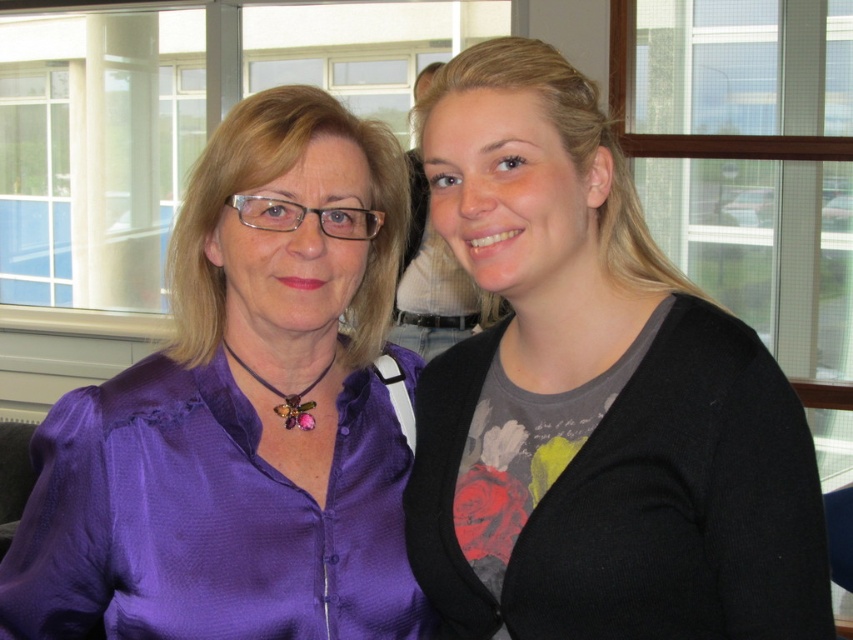
Question: Which of the following is the farthest from the observer?

Choices:
 (A) black matte sweater at right
 (B) purple satin blouse at center

Answer: (B)

Question: Is black matte sweater at right closer to camera compared to purple satin blouse at center?

Choices:
 (A) no
 (B) yes

Answer: (B)

Question: Can you confirm if black matte sweater at right is positioned to the left of purple satin blouse at center?

Choices:
 (A) no
 (B) yes

Answer: (A)

Question: Does black matte sweater at right appear under purple satin blouse at center?

Choices:
 (A) yes
 (B) no

Answer: (B)